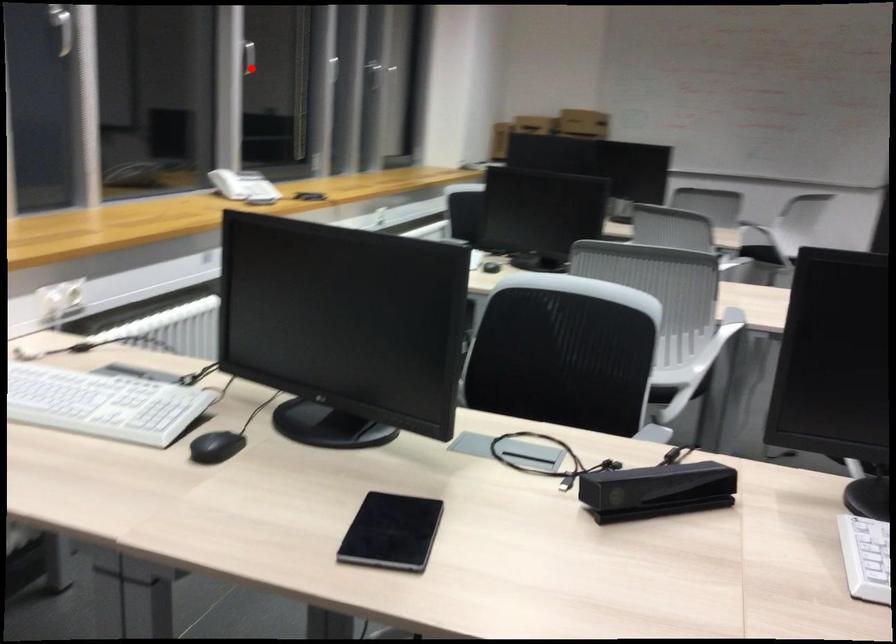
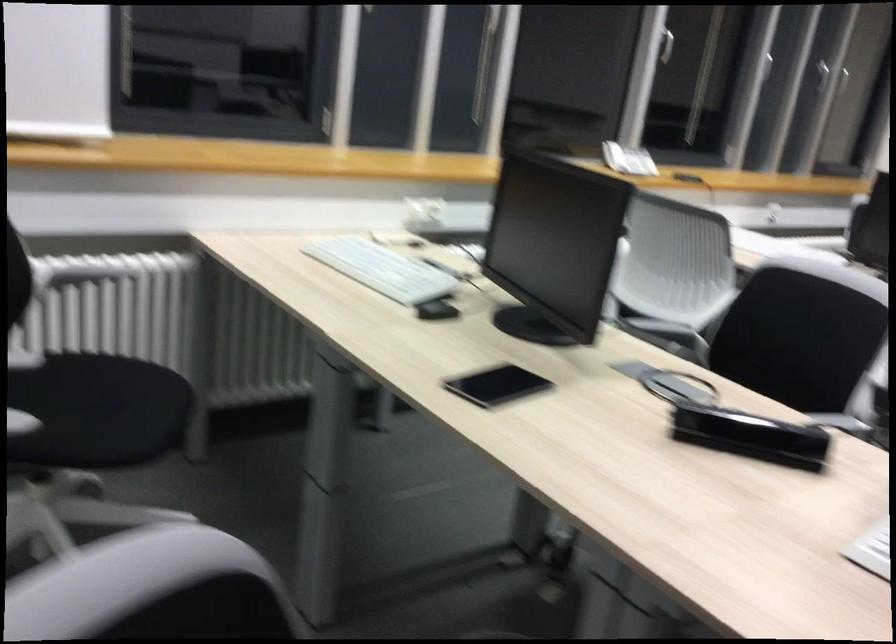
Locate, in the second image, the point that corresponds to the highlighted location in the first image.

(666, 46)